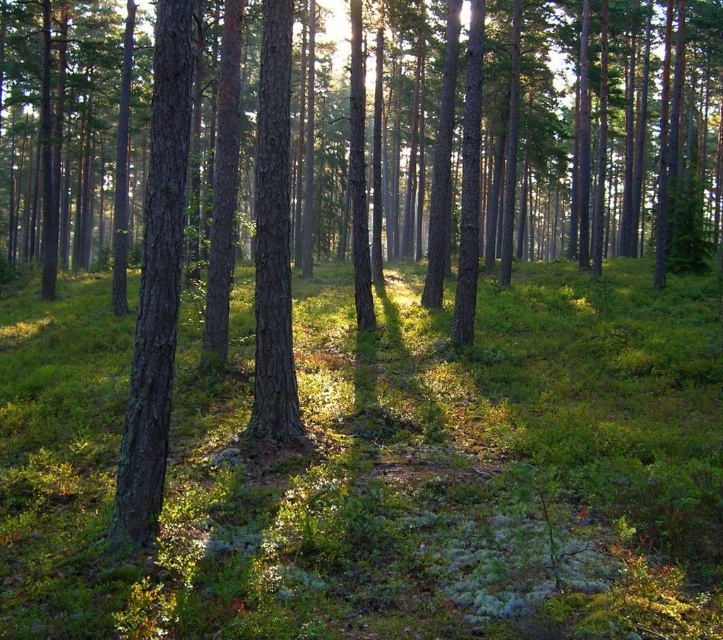
Does point (142, 518) lie in front of point (286, 436)?

Yes, point (142, 518) is closer to viewer.

Is smooth brown tree trunk at left in front of smooth bark tree at center?

Yes, it is.

Is point (183, 115) closer to camera compared to point (270, 72)?

Yes, it is in front of point (270, 72).

Identify the location of smooth brown tree trunk at left. This screenshot has height=640, width=723. (155, 285).